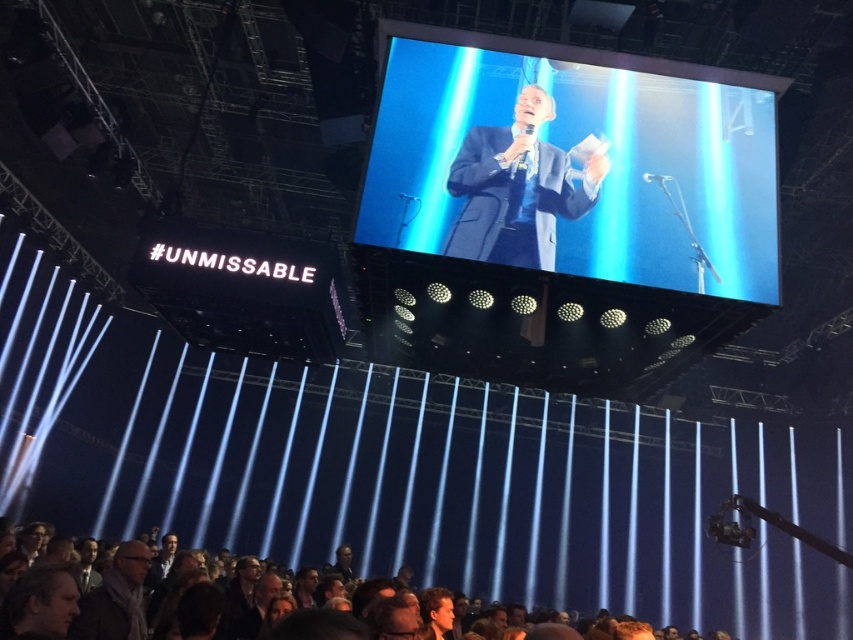
Who is shorter, shiny blue screen at center or dark gray scarf at lower left?

dark gray scarf at lower left is shorter.

Between shiny blue screen at center and dark gray scarf at lower left, which one is positioned lower?

dark gray scarf at lower left is below.

Where is `shiny blue screen at center`? The height and width of the screenshot is (640, 853). shiny blue screen at center is located at coordinates (573, 163).

Is dark blue suit at center smaller than dark gray scarf at lower left?

No.

Does dark blue suit at center appear on the left side of dark gray scarf at lower left?

No, dark blue suit at center is not to the left of dark gray scarf at lower left.

Is point (556, 172) positioned behind point (138, 573)?

Yes, point (556, 172) is farther from viewer.

Image resolution: width=853 pixels, height=640 pixels. I want to click on dark blue suit at center, so click(517, 188).

Which of these two, shiny blue screen at center or dark blue suit at center, stands shorter?

dark blue suit at center

Is point (425, 44) closer to viewer compared to point (543, 220)?

No, it is behind (543, 220).

Between point (422, 241) and point (575, 202), which one is positioned in front?

Point (422, 241)

The height and width of the screenshot is (640, 853). I want to click on shiny blue screen at center, so click(x=573, y=163).